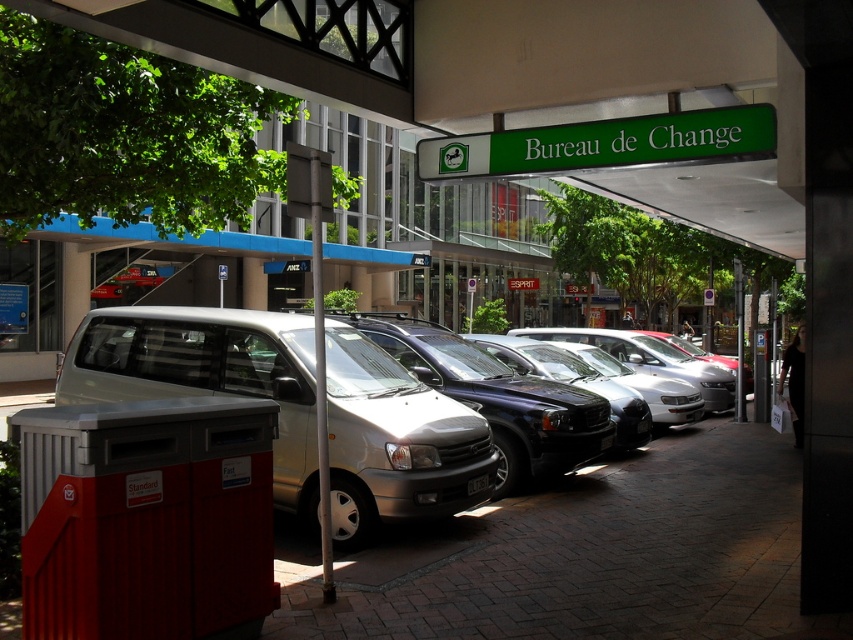
You are a delivery person who needs to park your van in a spot that is directly under a sign to avoid sunlight. The scene has a silver metallic van at center and a green plastic sign at upper center. Which object should you position your van under to stay shaded?

The silver metallic van at center is located below the green plastic sign at upper center, so positioning the van under the green plastic sign at upper center will provide shade.

You are a delivery driver who needs to park your 2.5m tall truck under the covered walkway. Based on the scene, will the silver metallic van at center and the green plastic sign at upper center allow enough vertical clearance for your truck?

The silver metallic van at center is much taller than the green plastic sign at upper center. Since your truck is 2.5m tall, you need to compare its height with the lowest obstacle. The green plastic sign at upper center is the lower one, but without knowing its exact height, it is uncertain if the truck will fit. Check the actual height of the green plastic sign at upper center before deciding.

You are a pedestrian standing on the sidewalk in the image. You see the silver metallic van at center and the green plastic sign at upper center. Which object is positioned to the left of the other?

The silver metallic van at center is positioned to the left of green plastic sign at upper center.